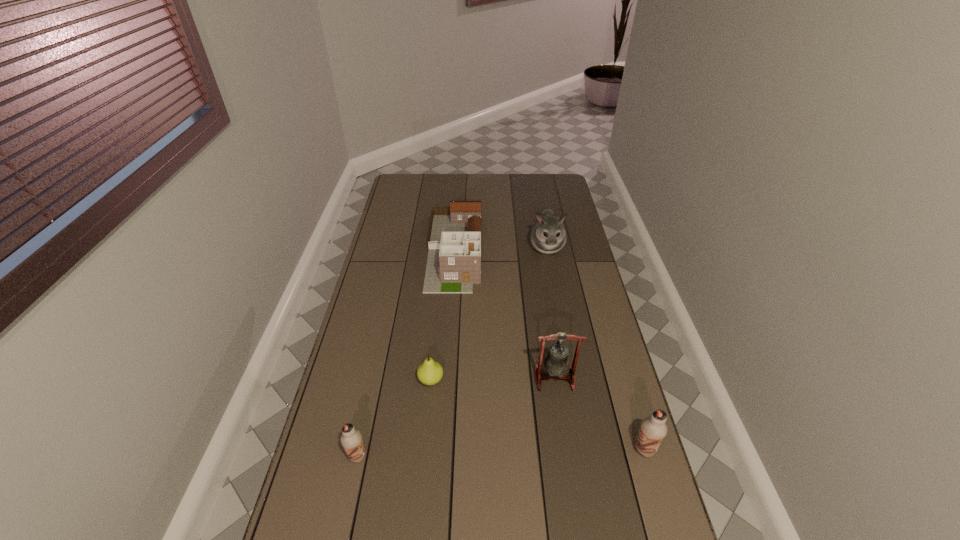
If equal spacing is the goal by inserting an additional chocolate_milk among them, please point out a vacant space for this new chocolate_milk. Please provide its 2D coordinates. Your answer should be formatted as a tuple, i.e. [(x, y)], where the tuple contains the x and y coordinates of a point satisfying the conditions above.

[(502, 453)]